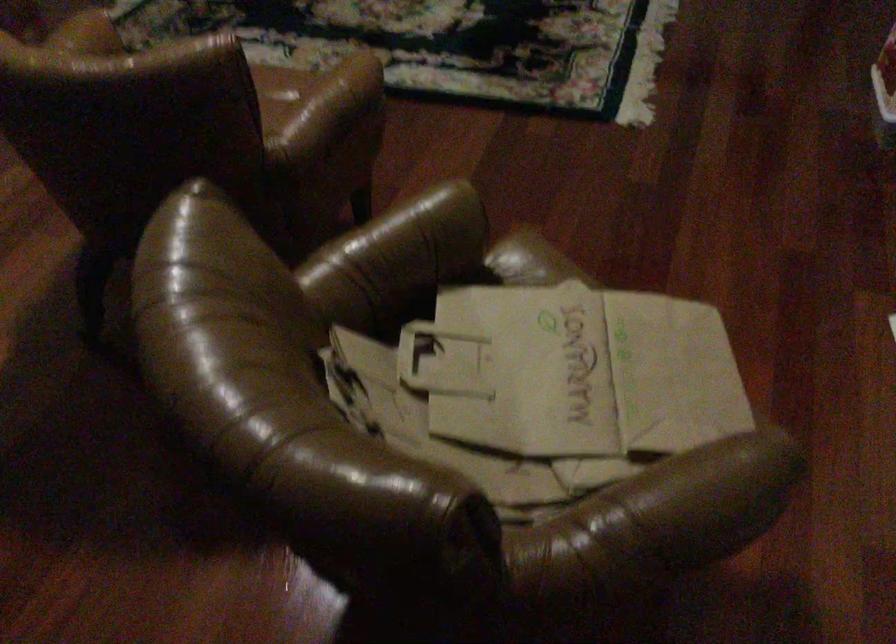
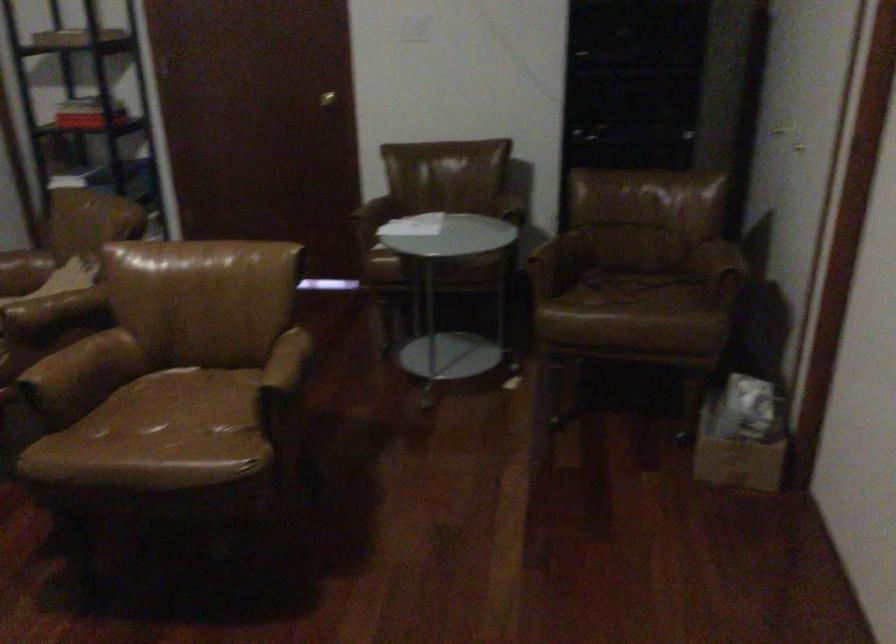
The point at (321, 96) is marked in the first image. Where is the corresponding point in the second image?

(61, 361)